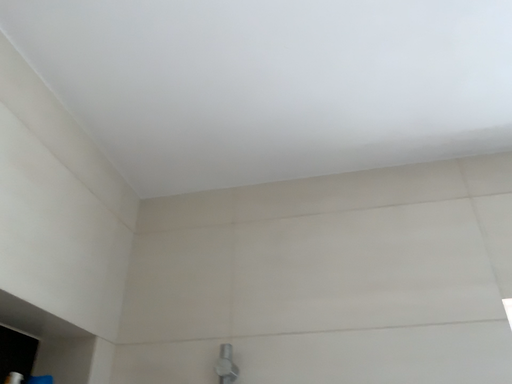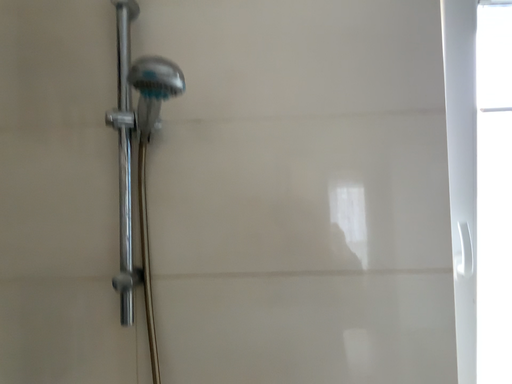
Question: How did the camera likely rotate when shooting the video?

Choices:
 (A) rotated right
 (B) rotated left

Answer: (A)